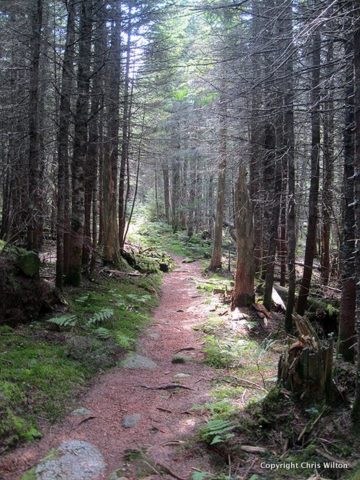
Locate an element on the screen. This screenshot has width=360, height=480. fern type plant is located at coordinates (67, 323), (97, 319), (218, 434).